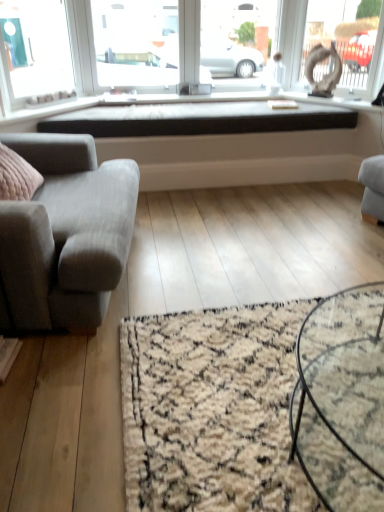
Question: Does black glass coffee table at center appear on the right side of matte white statue at upper right?

Choices:
 (A) no
 (B) yes

Answer: (A)

Question: Is black glass coffee table at center facing towards matte white statue at upper right?

Choices:
 (A) no
 (B) yes

Answer: (A)

Question: Considering the relative positions of black glass coffee table at center and matte white statue at upper right in the image provided, is black glass coffee table at center in front of matte white statue at upper right?

Choices:
 (A) yes
 (B) no

Answer: (A)

Question: Would you say black glass coffee table at center is outside matte white statue at upper right?

Choices:
 (A) yes
 (B) no

Answer: (A)

Question: Is the position of black glass coffee table at center more distant than that of matte white statue at upper right?

Choices:
 (A) no
 (B) yes

Answer: (A)

Question: In terms of width, does black glass coffee table at center look wider or thinner when compared to beige shaggy rug at lower center?

Choices:
 (A) thin
 (B) wide

Answer: (A)

Question: Is black glass coffee table at center spatially inside beige shaggy rug at lower center, or outside of it?

Choices:
 (A) outside
 (B) inside

Answer: (A)

Question: Considering the relative positions of black glass coffee table at center and beige shaggy rug at lower center in the image provided, is black glass coffee table at center to the left or to the right of beige shaggy rug at lower center?

Choices:
 (A) left
 (B) right

Answer: (B)

Question: Is point (350, 338) positioned closer to the camera than point (306, 351)?

Choices:
 (A) farther
 (B) closer

Answer: (A)

Question: Does point (157, 129) appear closer or farther from the camera than point (266, 452)?

Choices:
 (A) farther
 (B) closer

Answer: (A)

Question: Would you say black matte window sill at center is inside or outside beige shaggy rug at lower center?

Choices:
 (A) inside
 (B) outside

Answer: (B)

Question: From their relative heights in the image, would you say black matte window sill at center is taller or shorter than beige shaggy rug at lower center?

Choices:
 (A) tall
 (B) short

Answer: (A)

Question: Would you say black matte window sill at center is to the left or to the right of beige shaggy rug at lower center in the picture?

Choices:
 (A) left
 (B) right

Answer: (A)

Question: From a real-world perspective, relative to beige shaggy rug at lower center, is transparent glass window screen at upper center vertically above or below?

Choices:
 (A) below
 (B) above

Answer: (B)

Question: Visually, is transparent glass window screen at upper center positioned to the left or to the right of beige shaggy rug at lower center?

Choices:
 (A) left
 (B) right

Answer: (A)